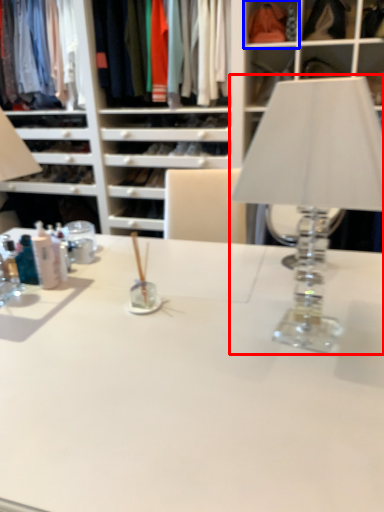
Question: Which point is further to the camera, table lamp (highlighted by a red box) or cabinet (highlighted by a blue box)?

Choices:
 (A) table lamp
 (B) cabinet

Answer: (B)